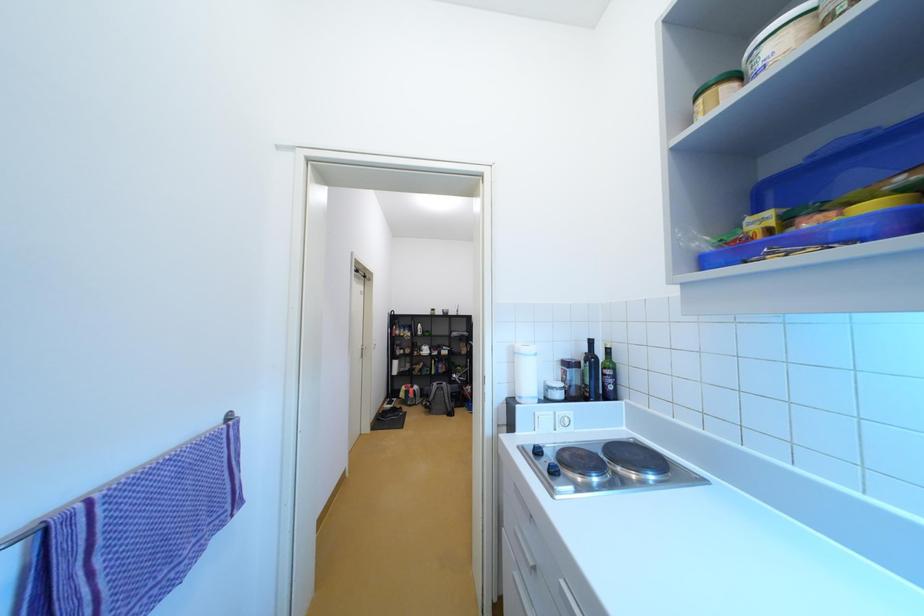
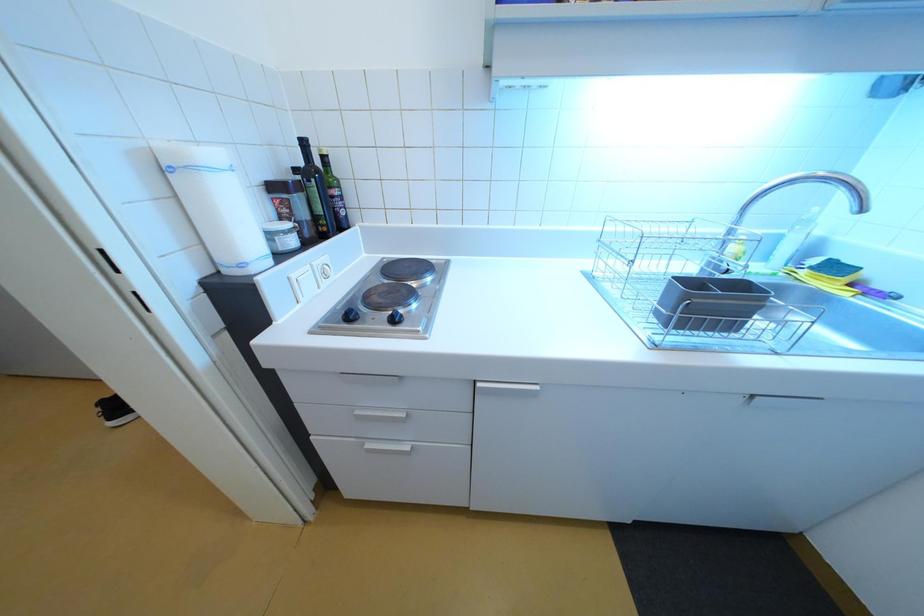
The images are taken continuously from a first-person perspective. In which direction is your viewpoint rotating?

The camera rotated toward right-down.